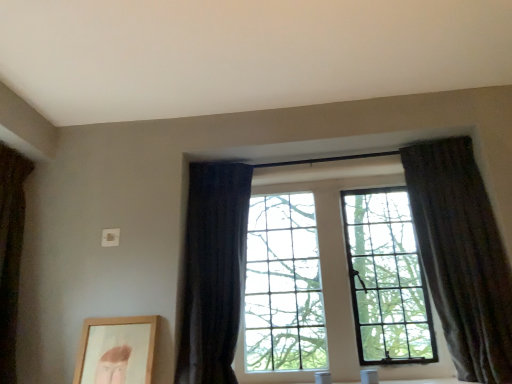
This screenshot has width=512, height=384. Describe the element at coordinates (462, 256) in the screenshot. I see `dark textured curtain at right, marked as the 3th curtain in a left-to-right arrangement` at that location.

The width and height of the screenshot is (512, 384). Describe the element at coordinates (10, 252) in the screenshot. I see `dark fabric curtain at left, which is the third curtain from right to left` at that location.

I want to click on dark textured curtain at right, which ranks as the first curtain in right-to-left order, so click(462, 256).

Considering the sizes of objects dark fabric curtain at left, which is the third curtain from right to left, and dark fabric curtain at center, the 2th curtain viewed from the left, in the image provided, who is taller, dark fabric curtain at left, which is the third curtain from right to left, or dark fabric curtain at center, the 2th curtain viewed from the left,?

With more height is dark fabric curtain at center, the 2th curtain viewed from the left.

In terms of width, does dark fabric curtain at left, which is the third curtain from right to left, look wider or thinner when compared to dark fabric curtain at center, the 2th curtain viewed from the left?

In the image, dark fabric curtain at left, which is the third curtain from right to left, appears to be wider than dark fabric curtain at center, the 2th curtain viewed from the left.

Between dark fabric curtain at left, acting as the first curtain starting from the left, and dark fabric curtain at center, placed as the second curtain when sorted from right to left, which one appears on the right side from the viewer's perspective?

dark fabric curtain at center, placed as the second curtain when sorted from right to left.

Considering the positions of objects dark textured curtain at right, marked as the 3th curtain in a left-to-right arrangement, and wooden picture frame at lower left in the image provided, who is more to the right, dark textured curtain at right, marked as the 3th curtain in a left-to-right arrangement, or wooden picture frame at lower left?

Positioned to the right is dark textured curtain at right, marked as the 3th curtain in a left-to-right arrangement.

Considering the sizes of objects dark textured curtain at right, which ranks as the first curtain in right-to-left order, and wooden picture frame at lower left in the image provided, who is taller, dark textured curtain at right, which ranks as the first curtain in right-to-left order, or wooden picture frame at lower left?

With more height is dark textured curtain at right, which ranks as the first curtain in right-to-left order.

Can you see dark textured curtain at right, marked as the 3th curtain in a left-to-right arrangement, touching wooden picture frame at lower left?

They are not placed beside each other.

From a real-world perspective, is wooden picture frame at lower left positioned above or below dark fabric curtain at left, which is the third curtain from right to left?

In terms of real-world spatial position, wooden picture frame at lower left is below dark fabric curtain at left, which is the third curtain from right to left.

Is wooden picture frame at lower left positioned far away from dark fabric curtain at left, acting as the first curtain starting from the left?

Actually, wooden picture frame at lower left and dark fabric curtain at left, acting as the first curtain starting from the left, are a little close together.

Image resolution: width=512 pixels, height=384 pixels. There is a wooden picture frame at lower left. What are the coordinates of `the 2nd curtain above it (from the image's perspective)` in the screenshot? It's located at (10, 252).

Which is more distant, [121,347] or [26,158]?

The point [26,158] is more distant.

Considering the relative positions of dark textured curtain at right, which ranks as the first curtain in right-to-left order, and dark fabric curtain at left, acting as the first curtain starting from the left, in the image provided, is dark textured curtain at right, which ranks as the first curtain in right-to-left order, to the right of dark fabric curtain at left, acting as the first curtain starting from the left, from the viewer's perspective?

Yes.

Consider the image. How distant is dark textured curtain at right, marked as the 3th curtain in a left-to-right arrangement, from dark fabric curtain at left, acting as the first curtain starting from the left?

They are 1.97 meters apart.

Can dark fabric curtain at left, which is the third curtain from right to left, be found inside dark textured curtain at right, marked as the 3th curtain in a left-to-right arrangement?

No, dark fabric curtain at left, which is the third curtain from right to left, is not inside dark textured curtain at right, marked as the 3th curtain in a left-to-right arrangement.

Is dark textured curtain at right, marked as the 3th curtain in a left-to-right arrangement, in front of or behind dark fabric curtain at left, which is the third curtain from right to left, in the image?

In the image, dark textured curtain at right, marked as the 3th curtain in a left-to-right arrangement, appears behind dark fabric curtain at left, which is the third curtain from right to left.

From a real-world perspective, does wooden picture frame at lower left sit lower than dark fabric curtain at center, placed as the second curtain when sorted from right to left?

Indeed, from a real-world perspective, wooden picture frame at lower left is positioned beneath dark fabric curtain at center, placed as the second curtain when sorted from right to left.

From the image's perspective, who appears lower, wooden picture frame at lower left or dark fabric curtain at center, placed as the second curtain when sorted from right to left?

wooden picture frame at lower left, from the image's perspective.

I want to click on picture frame on the left of dark fabric curtain at center, placed as the second curtain when sorted from right to left, so click(116, 350).

Does point (135, 330) come farther from viewer compared to point (239, 286)?

No, (135, 330) is closer to viewer.

Considering the points (22, 188) and (483, 223), which point is behind, point (22, 188) or point (483, 223)?

The point (22, 188) is more distant.

At what (x,y) coordinates should I click in order to perform the action: click on the 1st curtain located beneath the dark fabric curtain at left, which is the third curtain from right to left (from a real-world perspective). Please return your answer as a coordinate pair (x, y). This screenshot has height=384, width=512. Looking at the image, I should click on (462, 256).

Considering the relative sizes of dark fabric curtain at left, acting as the first curtain starting from the left, and dark textured curtain at right, which ranks as the first curtain in right-to-left order, in the image provided, is dark fabric curtain at left, acting as the first curtain starting from the left, shorter than dark textured curtain at right, which ranks as the first curtain in right-to-left order,?

Indeed, dark fabric curtain at left, acting as the first curtain starting from the left, has a lesser height compared to dark textured curtain at right, which ranks as the first curtain in right-to-left order.

From a real-world perspective, which is physically above, dark fabric curtain at left, acting as the first curtain starting from the left, or dark textured curtain at right, which ranks as the first curtain in right-to-left order?

In real-world perspective, dark fabric curtain at left, acting as the first curtain starting from the left, is above.

From the image's perspective, is dark textured curtain at right, marked as the 3th curtain in a left-to-right arrangement, under dark fabric curtain at center, the 2th curtain viewed from the left?

No.

In terms of size, does dark textured curtain at right, which ranks as the first curtain in right-to-left order, appear bigger or smaller than dark fabric curtain at center, the 2th curtain viewed from the left?

Considering their sizes, dark textured curtain at right, which ranks as the first curtain in right-to-left order, takes up more space than dark fabric curtain at center, the 2th curtain viewed from the left.

Who is taller, dark textured curtain at right, marked as the 3th curtain in a left-to-right arrangement, or dark fabric curtain at center, placed as the second curtain when sorted from right to left?

Standing taller between the two is dark textured curtain at right, marked as the 3th curtain in a left-to-right arrangement.

Find the location of a particular element. the 1st curtain to the right when counting from the dark fabric curtain at left, acting as the first curtain starting from the left is located at coordinates [212, 271].

At what (x,y) coordinates should I click in order to perform the action: click on picture frame that appears below the dark textured curtain at right, which ranks as the first curtain in right-to-left order (from the image's perspective). Please return your answer as a coordinate pair (x, y). The height and width of the screenshot is (384, 512). Looking at the image, I should click on 116,350.

Which object lies nearer to the anchor point dark textured curtain at right, which ranks as the first curtain in right-to-left order, wooden picture frame at lower left or dark fabric curtain at center, placed as the second curtain when sorted from right to left?

dark fabric curtain at center, placed as the second curtain when sorted from right to left, is positioned closer to the anchor dark textured curtain at right, which ranks as the first curtain in right-to-left order.

From the image, which object appears to be farther from dark fabric curtain at center, placed as the second curtain when sorted from right to left, wooden picture frame at lower left or dark fabric curtain at left, acting as the first curtain starting from the left?

Based on the image, dark fabric curtain at left, acting as the first curtain starting from the left, appears to be further to dark fabric curtain at center, placed as the second curtain when sorted from right to left.

Looking at the image, which one is located closer to dark fabric curtain at left, acting as the first curtain starting from the left, dark textured curtain at right, which ranks as the first curtain in right-to-left order, or dark fabric curtain at center, the 2th curtain viewed from the left?

→ Among the two, dark fabric curtain at center, the 2th curtain viewed from the left, is located nearer to dark fabric curtain at left, acting as the first curtain starting from the left.

From the image, which object appears to be nearer to dark fabric curtain at left, which is the third curtain from right to left, wooden picture frame at lower left or dark textured curtain at right, marked as the 3th curtain in a left-to-right arrangement?

wooden picture frame at lower left lies closer to dark fabric curtain at left, which is the third curtain from right to left, than the other object.

Consider the image. Estimate the real-world distances between objects in this image. Which object is closer to dark fabric curtain at center, placed as the second curtain when sorted from right to left, dark fabric curtain at left, acting as the first curtain starting from the left, or wooden picture frame at lower left?

wooden picture frame at lower left is closer to dark fabric curtain at center, placed as the second curtain when sorted from right to left.

From the image, which object appears to be nearer to dark fabric curtain at center, placed as the second curtain when sorted from right to left, dark fabric curtain at left, acting as the first curtain starting from the left, or dark textured curtain at right, which ranks as the first curtain in right-to-left order?

dark fabric curtain at left, acting as the first curtain starting from the left.

Which object lies nearer to the anchor point wooden picture frame at lower left, dark textured curtain at right, marked as the 3th curtain in a left-to-right arrangement, or dark fabric curtain at center, placed as the second curtain when sorted from right to left?

dark fabric curtain at center, placed as the second curtain when sorted from right to left, lies closer to wooden picture frame at lower left than the other object.

Estimate the real-world distances between objects in this image. Which object is closer to dark textured curtain at right, which ranks as the first curtain in right-to-left order, dark fabric curtain at center, the 2th curtain viewed from the left, or wooden picture frame at lower left?

dark fabric curtain at center, the 2th curtain viewed from the left.

Locate an element on the screen. Image resolution: width=512 pixels, height=384 pixels. curtain between wooden picture frame at lower left and dark textured curtain at right, which ranks as the first curtain in right-to-left order is located at coordinates (212, 271).

Identify the location of curtain between dark fabric curtain at left, acting as the first curtain starting from the left, and dark textured curtain at right, which ranks as the first curtain in right-to-left order, from left to right. (212, 271).

Identify the location of picture frame between dark fabric curtain at left, acting as the first curtain starting from the left, and dark fabric curtain at center, placed as the second curtain when sorted from right to left, in the horizontal direction. The image size is (512, 384). (116, 350).

The height and width of the screenshot is (384, 512). I want to click on picture frame between dark fabric curtain at left, acting as the first curtain starting from the left, and dark textured curtain at right, marked as the 3th curtain in a left-to-right arrangement, in the horizontal direction, so click(116, 350).